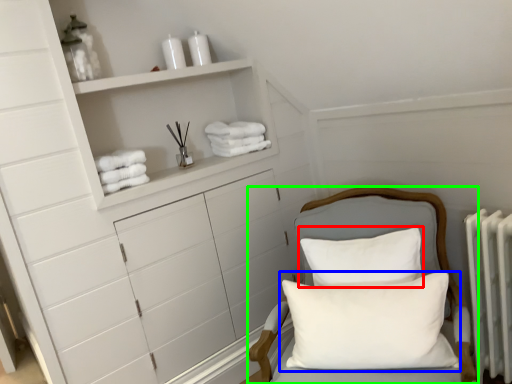
Question: Which object is positioned closest to pillow (highlighted by a red box)? Select from pillow (highlighted by a blue box) and furniture (highlighted by a green box).

Choices:
 (A) pillow
 (B) furniture

Answer: (A)